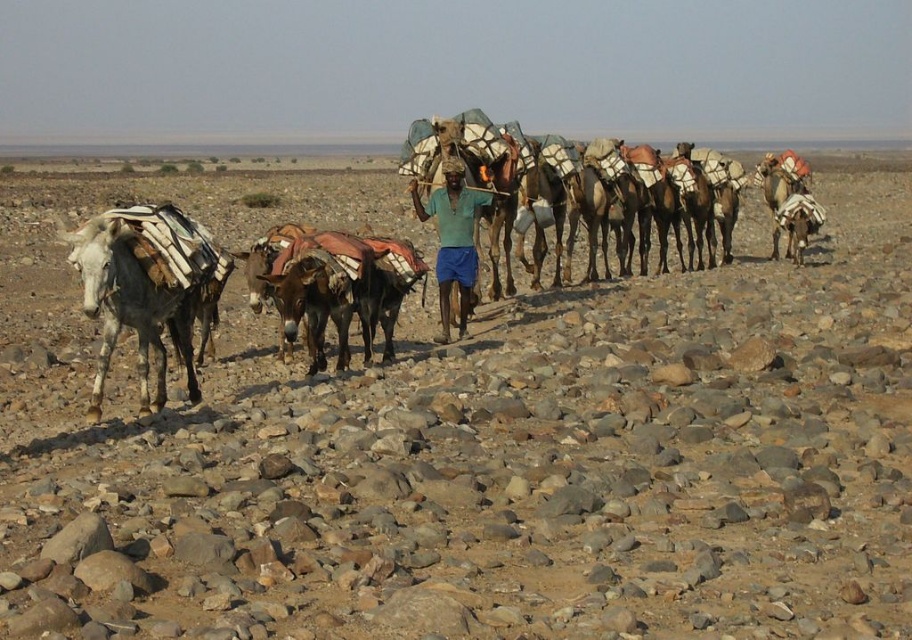
You are standing at the origin point of the coordinate system in the desert scene. The speckled gray mule at left is at point [130,307]. If you want to move towards the mule, which direction should you go?

To reach the speckled gray mule at left located at coordinates [130,307], you should move northeast since the x and y coordinates are both positive from the origin.

You are a traveler in the desert and notice the green fabric shirt at center and the white textured blanket at right. Which item is higher in the scene?

The green fabric shirt at center is taller than the white textured blanket at right.